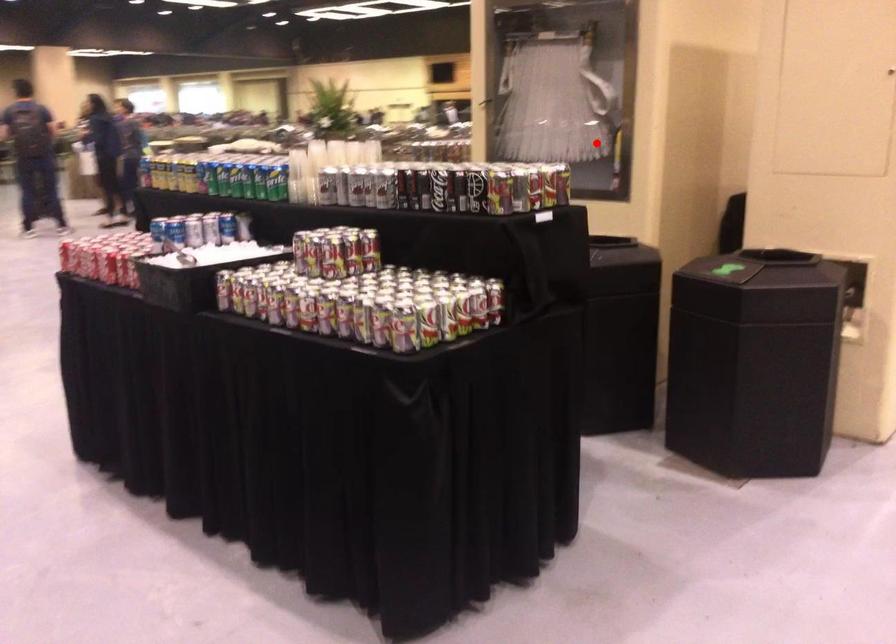
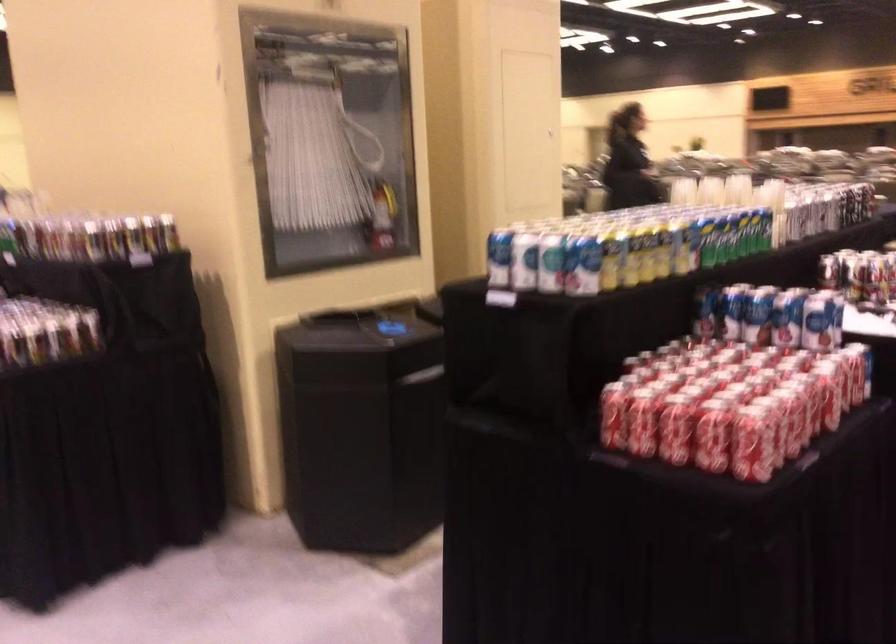
The point at the highlighted location is marked in the first image. Where is the corresponding point in the second image?

(382, 216)